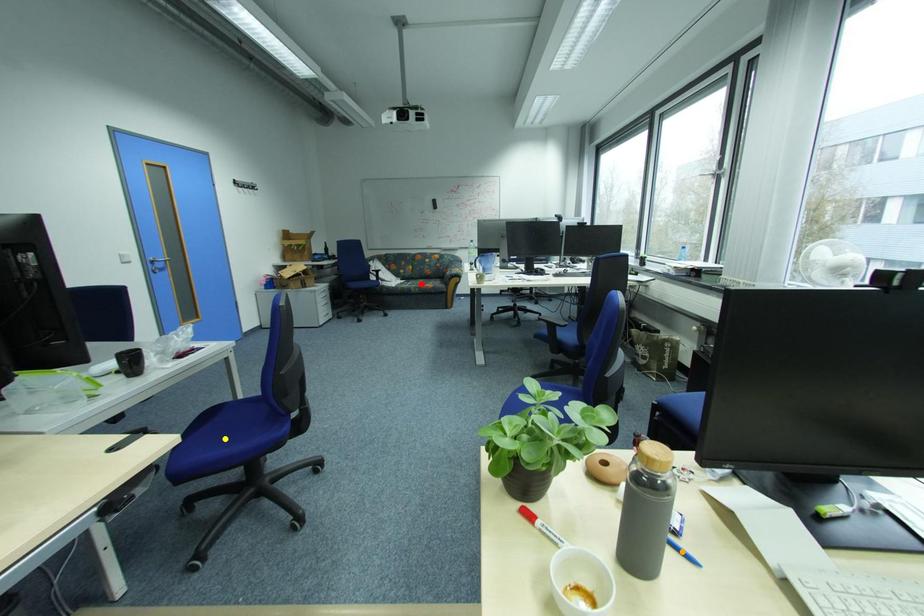
Order these from nearest to farthest:
- orange point
- red point
- yellow point

orange point → yellow point → red point